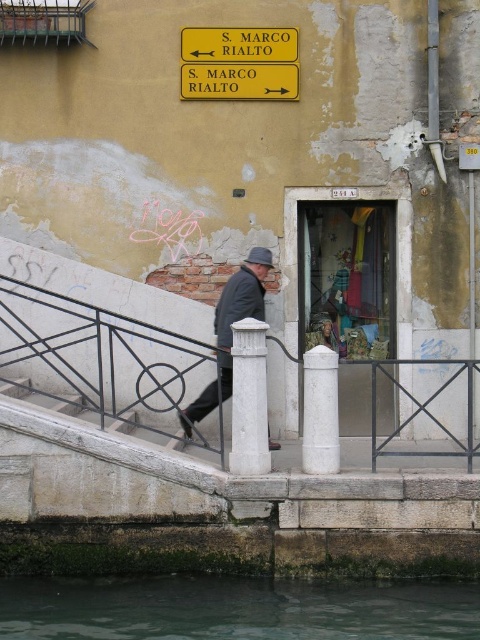
Does black metal railing at lower left have a lesser height compared to yellowmaterial/texturestreet sign at upper center?

Incorrect, black metal railing at lower left's height does not fall short of yellowmaterial/texturestreet sign at upper center's.

Consider the image. Which of these two, black metal railing at lower left or yellowmaterial/texturestreet sign at upper center, stands shorter?

With less height is yellowmaterial/texturestreet sign at upper center.

Is point (343, 426) less distant than point (204, 83)?

No, it is not.

Locate an element on the screen. black metal railing at lower left is located at coordinates (97, 360).

Which is above, matte gray coat at center or white smooth pillar at lower center?

matte gray coat at center

Does matte gray coat at center have a larger size compared to white smooth pillar at lower center?

Yes.

Who is more distant from viewer, (x=212, y=385) or (x=311, y=384)?

The point (x=212, y=385) is more distant.

The width and height of the screenshot is (480, 640). I want to click on matte gray coat at center, so click(x=240, y=307).

Is white smooth pillar at lower center to the left of yellow/yellowish paper at upper center from the viewer's perspective?

Incorrect, white smooth pillar at lower center is not on the left side of yellow/yellowish paper at upper center.

Based on the photo, can you confirm if white smooth pillar at lower center is positioned above yellow/yellowish paper at upper center?

Actually, white smooth pillar at lower center is below yellow/yellowish paper at upper center.

I want to click on white smooth pillar at lower center, so click(x=320, y=412).

Locate an element on the screen. The height and width of the screenshot is (640, 480). white smooth pillar at lower center is located at coordinates (320, 412).